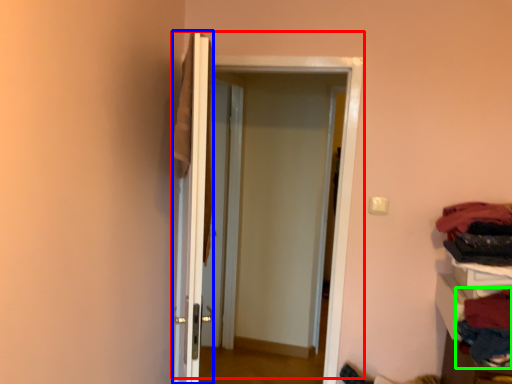
Question: Estimate the real-world distances between objects in this image. Which object is farther from door (highlighted by a red box), door (highlighted by a blue box) or clothing (highlighted by a green box)?

Choices:
 (A) door
 (B) clothing

Answer: (B)